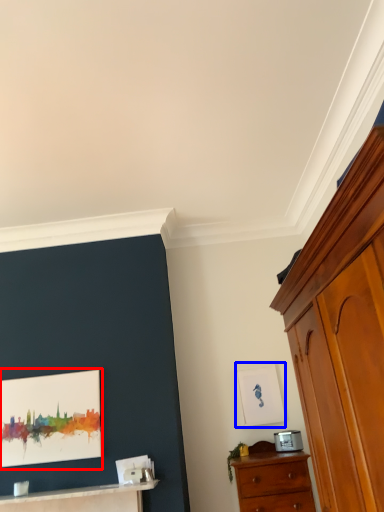
Question: Which point is further to the camera, picture frame (highlighted by a red box) or picture frame (highlighted by a blue box)?

Choices:
 (A) picture frame
 (B) picture frame

Answer: (B)